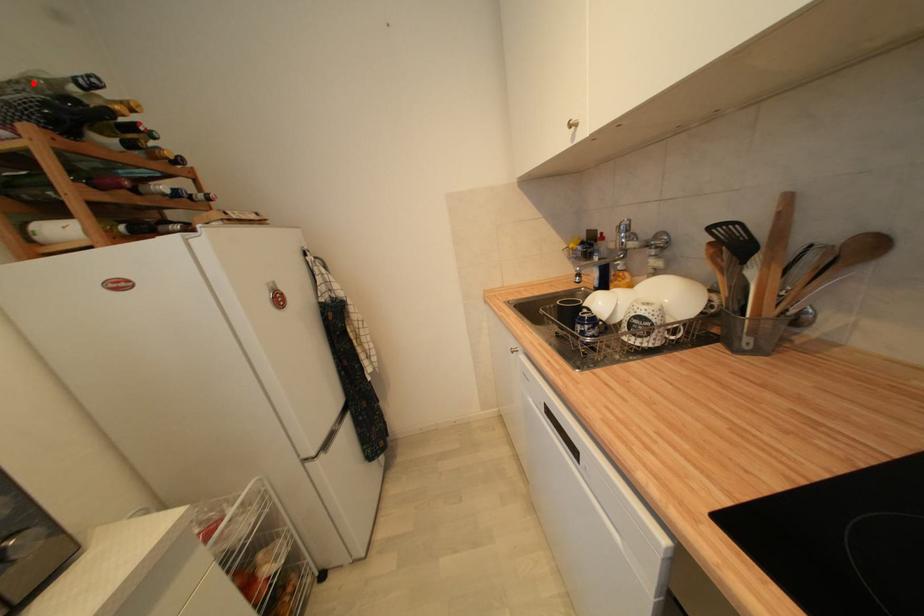
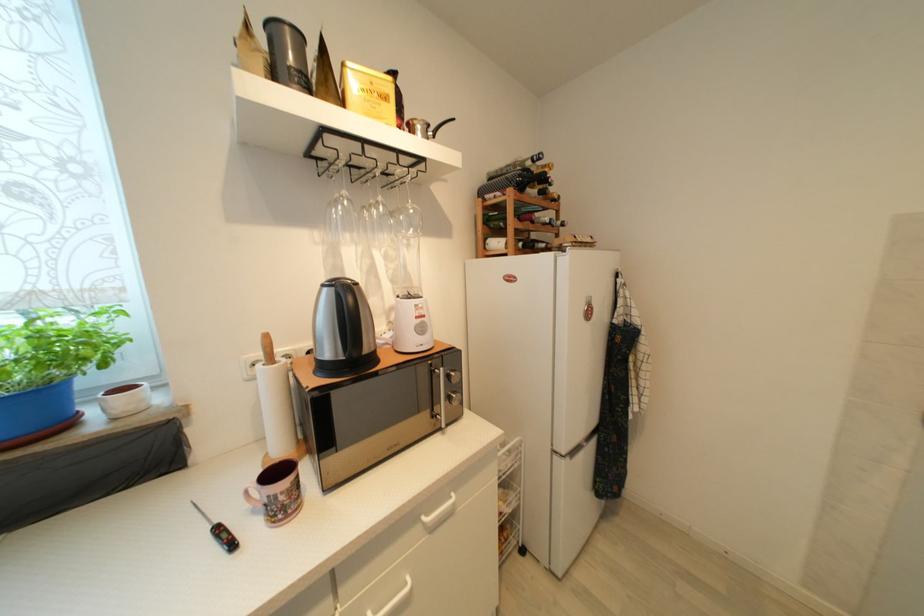
The point at the highlighted location is marked in the first image. Where is the corresponding point in the second image?

(518, 166)